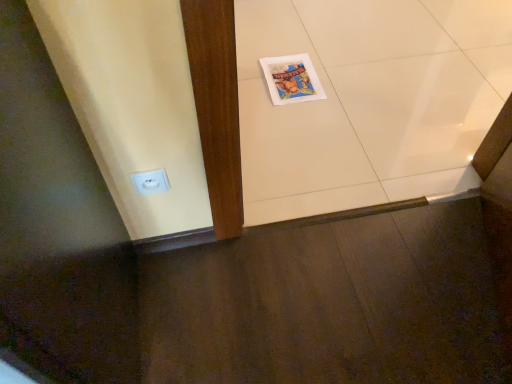
Question: Considering the relative sizes of matte paper comic book at center and white glossy tile at center in the image provided, is matte paper comic book at center thinner than white glossy tile at center?

Choices:
 (A) no
 (B) yes

Answer: (B)

Question: Is matte paper comic book at center facing away from white glossy tile at center?

Choices:
 (A) yes
 (B) no

Answer: (A)

Question: Is matte paper comic book at center further to the viewer compared to white glossy tile at center?

Choices:
 (A) no
 (B) yes

Answer: (B)

Question: Does matte paper comic book at center have a lesser height compared to white glossy tile at center?

Choices:
 (A) no
 (B) yes

Answer: (B)

Question: From the image's perspective, is matte paper comic book at center located beneath white glossy tile at center?

Choices:
 (A) no
 (B) yes

Answer: (A)

Question: Do you think white glossy tile at center is within matte paper comic book at center, or outside of it?

Choices:
 (A) outside
 (B) inside

Answer: (A)

Question: Does point (435, 114) appear closer or farther from the camera than point (290, 99)?

Choices:
 (A) closer
 (B) farther

Answer: (A)

Question: Looking at the image, does white glossy tile at center seem bigger or smaller compared to matte paper comic book at center?

Choices:
 (A) small
 (B) big

Answer: (B)

Question: Considering the positions of white glossy tile at center and matte paper comic book at center in the image, is white glossy tile at center taller or shorter than matte paper comic book at center?

Choices:
 (A) tall
 (B) short

Answer: (A)

Question: Would you say matte paper comic book at center is to the left or to the right of white plastic electric outlet at lower left in the picture?

Choices:
 (A) right
 (B) left

Answer: (A)

Question: Considering the positions of matte paper comic book at center and white plastic electric outlet at lower left in the image, is matte paper comic book at center taller or shorter than white plastic electric outlet at lower left?

Choices:
 (A) short
 (B) tall

Answer: (A)

Question: Relative to white plastic electric outlet at lower left, is matte paper comic book at center in front or behind?

Choices:
 (A) front
 (B) behind

Answer: (B)

Question: Does point (311, 92) appear closer or farther from the camera than point (143, 180)?

Choices:
 (A) closer
 (B) farther

Answer: (B)

Question: From the image's perspective, is matte paper comic book at center above or below white glossy tile at center?

Choices:
 (A) below
 (B) above

Answer: (B)

Question: In terms of width, does matte paper comic book at center look wider or thinner when compared to white glossy tile at center?

Choices:
 (A) wide
 (B) thin

Answer: (B)